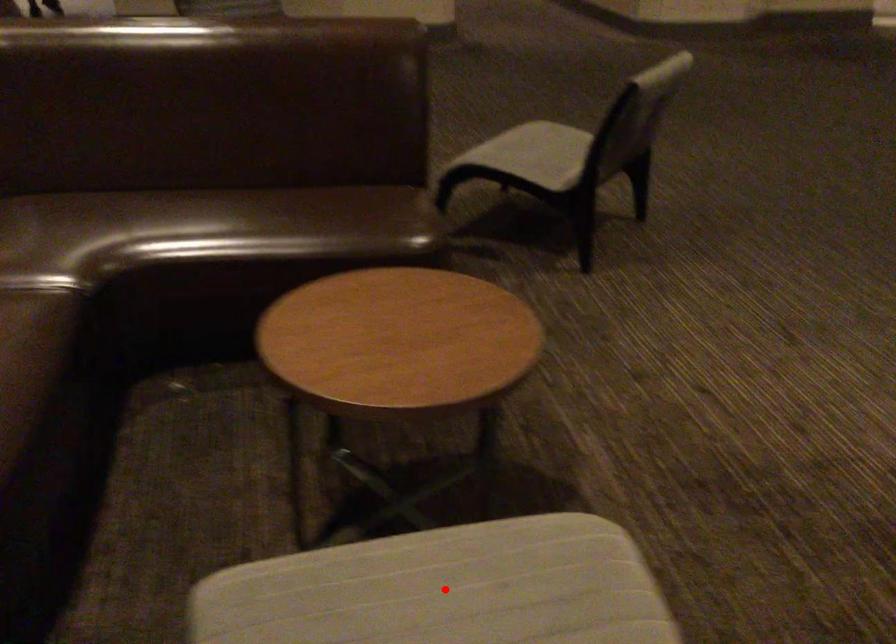
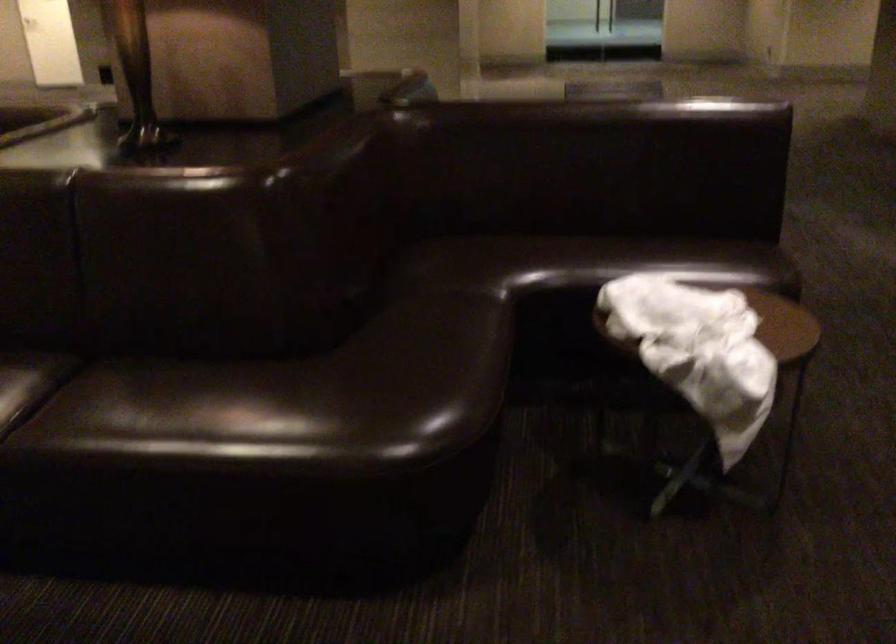
Question: I am providing you with two images of the same scene from different viewpoints. A red point is marked on the first image. At the location where the point appears in image 1, is it still visible in image 2?

Choices:
 (A) Yes
 (B) No

Answer: (B)